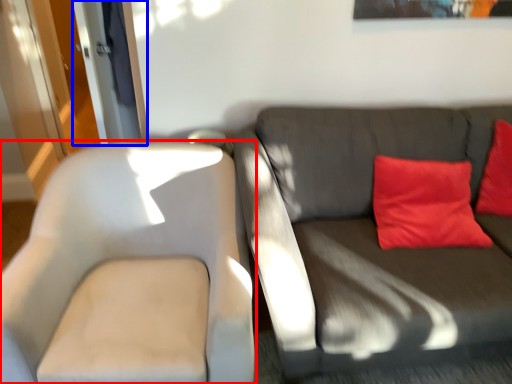
Question: Among these objects, which one is farthest to the camera, chair (highlighted by a red box) or glass door (highlighted by a blue box)?

Choices:
 (A) chair
 (B) glass door

Answer: (B)